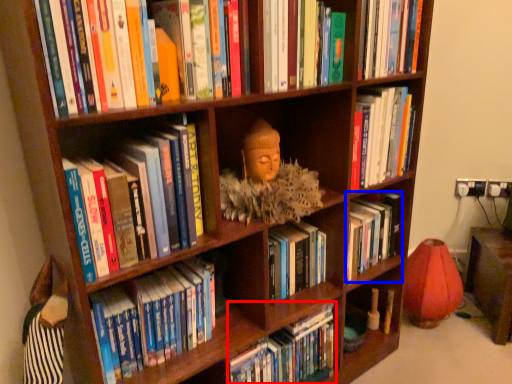
Question: Which of the following is the farthest to the observer, book (highlighted by a red box) or book (highlighted by a blue box)?

Choices:
 (A) book
 (B) book

Answer: (B)